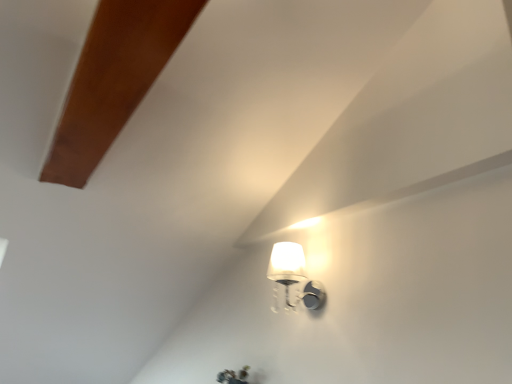
Question: Should I look upward or downward to see white glossy wall sconce at upper right?

Choices:
 (A) down
 (B) up

Answer: (A)